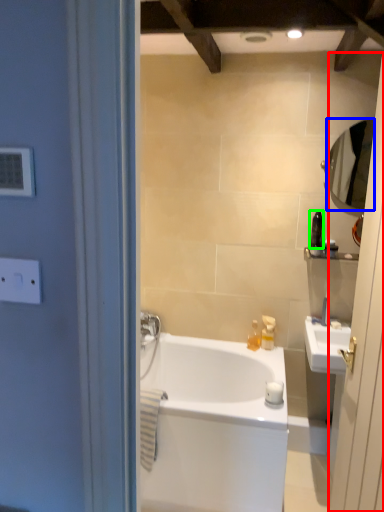
Question: Which is nearer to the screen door (highlighted by a red box)? mirror (highlighted by a blue box) or toiletry (highlighted by a green box).

Choices:
 (A) mirror
 (B) toiletry

Answer: (A)